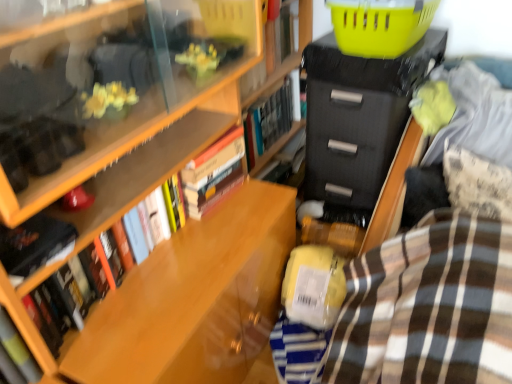
Measure the distance between point (297, 41) and camera.

Point (297, 41) is 1.95 meters from camera.

Find the location of a particular element. Image resolution: width=512 pixels, height=384 pixels. hardcover book at lower left, the 1th book in the front-to-back sequence is located at coordinates (18, 349).

Describe the element at coordinates (271, 118) in the screenshot. Image resolution: width=512 pixels, height=384 pixels. I see `hardcover book at center, the 1th book when ordered from back to front` at that location.

The image size is (512, 384). Describe the element at coordinates (136, 185) in the screenshot. I see `wooden bookshelf at center, which is the third book from front to back` at that location.

Where is `hardcover book at left, the 4th book from the back`? hardcover book at left, the 4th book from the back is located at coordinates (34, 245).

The height and width of the screenshot is (384, 512). What do you see at coordinates (428, 306) in the screenshot?
I see `brown striped blanket at lower right` at bounding box center [428, 306].

Identify the location of hardcover book at upper center, acting as the 4th book starting from the front. (273, 52).

Which of these two, yellow plastic basket at upper right or hardcover book at left, positioned as the second book in front-to-back order, stands shorter?

hardcover book at left, positioned as the second book in front-to-back order, is shorter.

From the image's perspective, is yellow plastic basket at upper right beneath hardcover book at left, positioned as the second book in front-to-back order?

No.

Is point (369, 1) positioned behind point (72, 233)?

Yes, it is.

Which is in front, yellow plastic basket at upper right or hardcover book at left, positioned as the second book in front-to-back order?

hardcover book at left, positioned as the second book in front-to-back order, is in front.

From the image's perspective, which is below, hardcover book at left, the 4th book from the back, or wooden bookshelf at center, which is counted as the third book, starting from the back?

hardcover book at left, the 4th book from the back.

Who is shorter, hardcover book at left, the 4th book from the back, or wooden bookshelf at center, which is the third book from front to back?

hardcover book at left, the 4th book from the back.

Does point (23, 250) come closer to viewer compared to point (142, 182)?

Yes, it is.

Is hardcover book at left, the 4th book from the back, further to the viewer compared to wooden bookshelf at center, which is counted as the third book, starting from the back?

No, hardcover book at left, the 4th book from the back, is closer to the camera.

Does point (38, 371) come farther from viewer compared to point (348, 53)?

No, (38, 371) is in front of (348, 53).

From a real-world perspective, which object rests below the other?

hardcover book at lower left, the fifth book from the back, is physically lower.

From the image's perspective, between hardcover book at lower left, the 1th book in the front-to-back sequence, and yellow plastic basket at upper right, who is located below?

hardcover book at lower left, the 1th book in the front-to-back sequence, is shown below in the image.

Can yellow plastic basket at upper right be found inside hardcover book at lower left, the 1th book in the front-to-back sequence?

Actually, yellow plastic basket at upper right is outside hardcover book at lower left, the 1th book in the front-to-back sequence.

Considering the positions of objects yellow plastic basket at upper right and black matte/file cabinet at upper right in the image provided, who is more to the left, yellow plastic basket at upper right or black matte/file cabinet at upper right?

black matte/file cabinet at upper right is more to the left.

Is yellow plastic basket at upper right positioned behind black matte/file cabinet at upper right?

No, yellow plastic basket at upper right is in front of black matte/file cabinet at upper right.

From the image's perspective, relative to black matte/file cabinet at upper right, is yellow plastic basket at upper right above or below?

Based on their image positions, yellow plastic basket at upper right is located above black matte/file cabinet at upper right.

Where is `the 5th book behind the brown striped blanket at lower right, starting your count from the anchor`? This screenshot has height=384, width=512. the 5th book behind the brown striped blanket at lower right, starting your count from the anchor is located at coordinates (271, 118).

How many degrees apart are the facing directions of hardcover book at center, the 1th book when ordered from back to front, and brown striped blanket at lower right?

92.3 degrees separate the facing orientations of hardcover book at center, the 1th book when ordered from back to front, and brown striped blanket at lower right.

Are hardcover book at center, the 1th book when ordered from back to front, and brown striped blanket at lower right making contact?

No, hardcover book at center, the 1th book when ordered from back to front, is not next to brown striped blanket at lower right.

Consider the image. Is hardcover book at center, the fifth book in the front-to-back sequence, looking in the opposite direction of brown striped blanket at lower right?

hardcover book at center, the fifth book in the front-to-back sequence, does not have its back to brown striped blanket at lower right.

What's the angular difference between hardcover book at center, the 1th book when ordered from back to front, and hardcover book at upper center, the second book in the back-to-front sequence,'s facing directions?

The angular difference between hardcover book at center, the 1th book when ordered from back to front, and hardcover book at upper center, the second book in the back-to-front sequence, is 0.00252 degrees.

In the scene shown: Is hardcover book at center, the 1th book when ordered from back to front, not inside hardcover book at upper center, acting as the 4th book starting from the front?

hardcover book at center, the 1th book when ordered from back to front, is positioned outside hardcover book at upper center, acting as the 4th book starting from the front.

From a real-world perspective, is hardcover book at center, the fifth book in the front-to-back sequence, over hardcover book at upper center, the second book in the back-to-front sequence?

No, from a real-world perspective, hardcover book at center, the fifth book in the front-to-back sequence, is not on top of hardcover book at upper center, the second book in the back-to-front sequence.

In the image, is hardcover book at center, the 1th book when ordered from back to front, positioned in front of or behind hardcover book at upper center, acting as the 4th book starting from the front?

Visually, hardcover book at center, the 1th book when ordered from back to front, is located behind hardcover book at upper center, acting as the 4th book starting from the front.

Is hardcover book at left, positioned as the second book in front-to-back order, to the left or to the right of hardcover book at center, the fifth book in the front-to-back sequence, in the image?

hardcover book at left, positioned as the second book in front-to-back order, is to the left of hardcover book at center, the fifth book in the front-to-back sequence.

From the image's perspective, is hardcover book at left, the 4th book from the back, below hardcover book at center, the 1th book when ordered from back to front?

Yes, from the image's perspective, hardcover book at left, the 4th book from the back, is beneath hardcover book at center, the 1th book when ordered from back to front.

Which of these two, hardcover book at left, positioned as the second book in front-to-back order, or hardcover book at center, the 1th book when ordered from back to front, is thinner?

Thinner between the two is hardcover book at left, positioned as the second book in front-to-back order.

Considering the sizes of objects hardcover book at left, the 4th book from the back, and hardcover book at center, the 1th book when ordered from back to front, in the image provided, who is smaller, hardcover book at left, the 4th book from the back, or hardcover book at center, the 1th book when ordered from back to front,?

Smaller between the two is hardcover book at left, the 4th book from the back.

Image resolution: width=512 pixels, height=384 pixels. What are the coordinates of `basket on the right of hardcover book at left, positioned as the second book in front-to-back order` in the screenshot? It's located at (380, 25).

From the image's perspective, starting from the hardcover book at left, positioned as the second book in front-to-back order, which book is the 1st one above? Please provide its 2D coordinates.

[(136, 185)]

Estimate the real-world distances between objects in this image. Which object is closer to wooden bookshelf at center, which is the third book from front to back, hardcover book at lower left, the fifth book from the back, or yellow plastic basket at upper right?

The object closer to wooden bookshelf at center, which is the third book from front to back, is hardcover book at lower left, the fifth book from the back.

Looking at the image, which one is located closer to brown striped blanket at lower right, hardcover book at left, the 4th book from the back, or black matte/file cabinet at upper right?

black matte/file cabinet at upper right lies closer to brown striped blanket at lower right than the other object.

Which object lies further to the anchor point hardcover book at upper center, the second book in the back-to-front sequence, brown striped blanket at lower right or hardcover book at center, the fifth book in the front-to-back sequence?

The object further to hardcover book at upper center, the second book in the back-to-front sequence, is brown striped blanket at lower right.

Looking at the image, which one is located closer to black matte/file cabinet at upper right, brown striped blanket at lower right or hardcover book at center, the 1th book when ordered from back to front?

hardcover book at center, the 1th book when ordered from back to front, is closer to black matte/file cabinet at upper right.

Based on their spatial positions, is yellow plastic basket at upper right or black matte/file cabinet at upper right closer to brown striped blanket at lower right?

black matte/file cabinet at upper right lies closer to brown striped blanket at lower right than the other object.

Based on their spatial positions, is hardcover book at upper center, the second book in the back-to-front sequence, or hardcover book at lower left, the fifth book from the back, closer to wooden bookshelf at center, which is counted as the third book, starting from the back?

hardcover book at lower left, the fifth book from the back, lies closer to wooden bookshelf at center, which is counted as the third book, starting from the back, than the other object.

Considering their positions, is wooden bookshelf at center, which is the third book from front to back, positioned closer to yellow plastic basket at upper right than black matte/file cabinet at upper right?

black matte/file cabinet at upper right is positioned closer to the anchor yellow plastic basket at upper right.

From the image, which object appears to be nearer to hardcover book at upper center, acting as the 4th book starting from the front, hardcover book at left, the 4th book from the back, or wooden bookshelf at center, which is counted as the third book, starting from the back?

wooden bookshelf at center, which is counted as the third book, starting from the back.

Where is `book between hardcover book at lower left, the fifth book from the back, and wooden bookshelf at center, which is the third book from front to back`? This screenshot has width=512, height=384. book between hardcover book at lower left, the fifth book from the back, and wooden bookshelf at center, which is the third book from front to back is located at coordinates (34, 245).

Locate an element on the screen. The height and width of the screenshot is (384, 512). file cabinet between wooden bookshelf at center, which is the third book from front to back, and yellow plastic basket at upper right from left to right is located at coordinates (362, 127).

The image size is (512, 384). In order to click on plaid between hardcover book at lower left, the 1th book in the front-to-back sequence, and yellow plastic basket at upper right from left to right in this screenshot , I will do `click(428, 306)`.

At what (x,y) coordinates should I click in order to perform the action: click on file cabinet between brown striped blanket at lower right and hardcover book at center, the fifth book in the front-to-back sequence, along the z-axis. Please return your answer as a coordinate pair (x, y). Looking at the image, I should click on (362, 127).